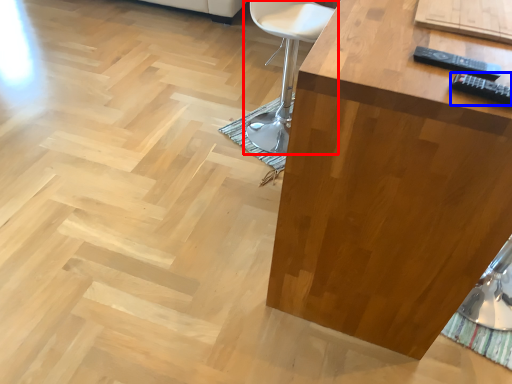
Question: Among these objects, which one is nearest to the camera, chair (highlighted by a red box) or remote (highlighted by a blue box)?

Choices:
 (A) chair
 (B) remote

Answer: (B)